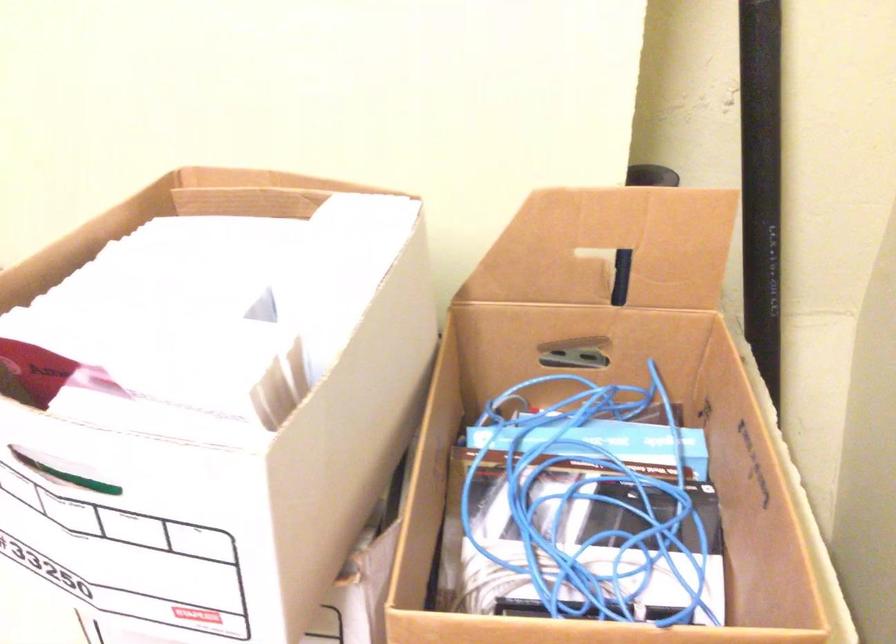
This screenshot has height=644, width=896. What do you see at coordinates (609, 247) in the screenshot?
I see `the cardboard box handle` at bounding box center [609, 247].